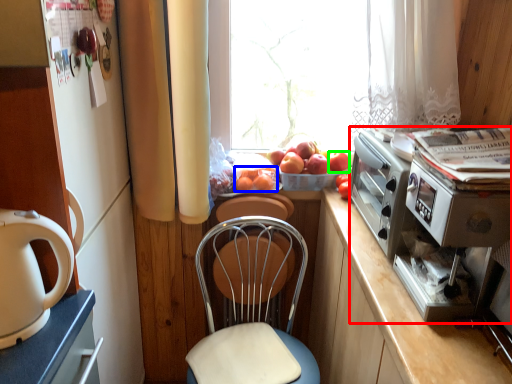
Question: Which object is positioned farthest from appliance (highlighted by a red box)? Select from fruit (highlighted by a blue box) and apple (highlighted by a green box).

Choices:
 (A) fruit
 (B) apple

Answer: (A)